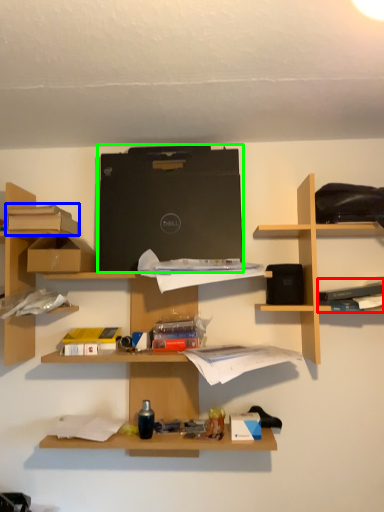
Question: Estimate the real-world distances between objects in this image. Which object is farther from book (highlighted by a red box), book (highlighted by a blue box) or computer (highlighted by a green box)?

Choices:
 (A) book
 (B) computer

Answer: (A)